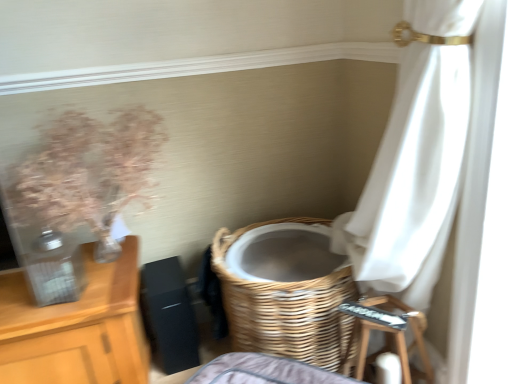
Question: Is translucent glass vase at left looking in the opposite direction of wooden step stool at lower right?

Choices:
 (A) no
 (B) yes

Answer: (A)

Question: Is translucent glass vase at left facing towards wooden step stool at lower right?

Choices:
 (A) no
 (B) yes

Answer: (A)

Question: Can you confirm if translucent glass vase at left is bigger than wooden step stool at lower right?

Choices:
 (A) yes
 (B) no

Answer: (A)

Question: From the image's perspective, is translucent glass vase at left below wooden step stool at lower right?

Choices:
 (A) no
 (B) yes

Answer: (A)

Question: Is translucent glass vase at left thinner than wooden step stool at lower right?

Choices:
 (A) no
 (B) yes

Answer: (A)

Question: Which is correct: woven wood basket at lower center is inside translucent glass vase at left, or outside of it?

Choices:
 (A) outside
 (B) inside

Answer: (A)

Question: Is woven wood basket at lower center taller or shorter than translucent glass vase at left?

Choices:
 (A) tall
 (B) short

Answer: (A)

Question: From a real-world perspective, is woven wood basket at lower center above or below translucent glass vase at left?

Choices:
 (A) below
 (B) above

Answer: (A)

Question: Visually, is woven wood basket at lower center positioned to the left or to the right of translucent glass vase at left?

Choices:
 (A) right
 (B) left

Answer: (A)

Question: Is woven wood basket at lower center inside or outside of wooden step stool at lower right?

Choices:
 (A) inside
 (B) outside

Answer: (B)

Question: From a real-world perspective, is woven wood basket at lower center positioned above or below wooden step stool at lower right?

Choices:
 (A) above
 (B) below

Answer: (A)

Question: Is woven wood basket at lower center to the left or to the right of wooden step stool at lower right in the image?

Choices:
 (A) left
 (B) right

Answer: (A)

Question: Considering their positions, is woven wood basket at lower center located in front of or behind wooden step stool at lower right?

Choices:
 (A) front
 (B) behind

Answer: (B)

Question: Considering the positions of wooden step stool at lower right and translucent glass vase at left in the image, is wooden step stool at lower right wider or thinner than translucent glass vase at left?

Choices:
 (A) thin
 (B) wide

Answer: (A)

Question: From their relative heights in the image, would you say wooden step stool at lower right is taller or shorter than translucent glass vase at left?

Choices:
 (A) short
 (B) tall

Answer: (A)